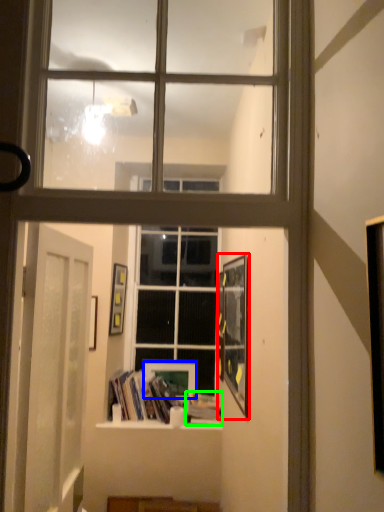
Question: Which is farther away from picture frame (highlighted by a red box)? picture frame (highlighted by a blue box) or paperback book (highlighted by a green box)?

Choices:
 (A) picture frame
 (B) paperback book

Answer: (A)